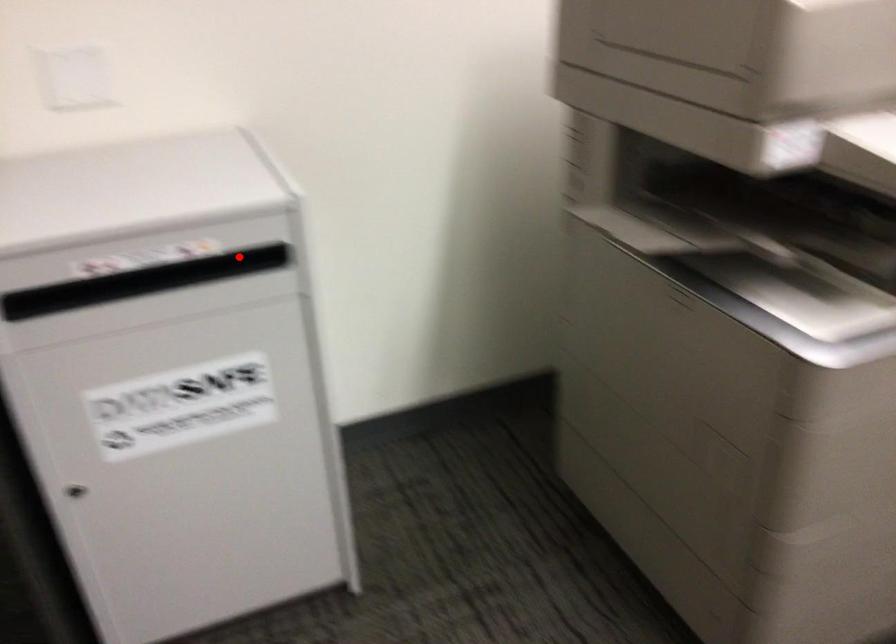
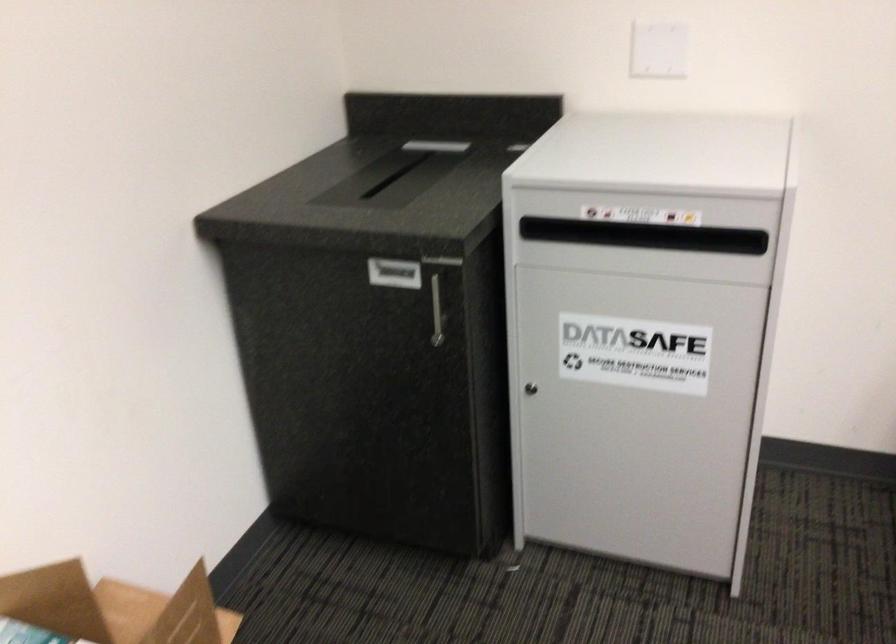
Where in the second image is the point corresponding to the highlighted location from the first image?

(746, 241)